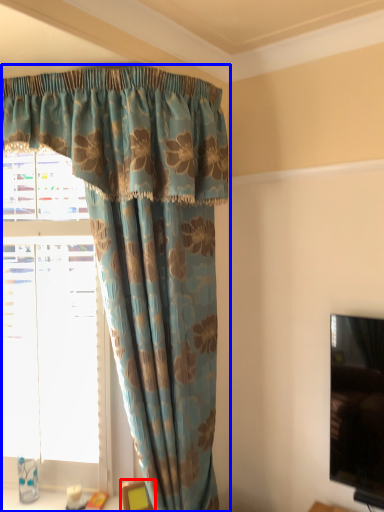
Question: Which object is further to the camera taking this photo, furniture (highlighted by a red box) or curtain (highlighted by a blue box)?

Choices:
 (A) furniture
 (B) curtain

Answer: (A)